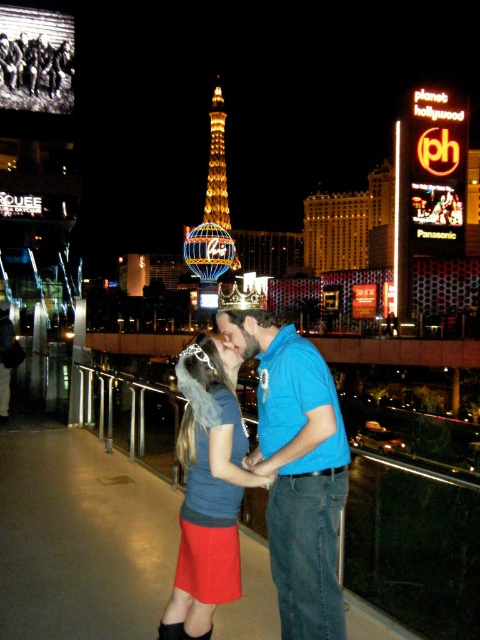
Question: Does matte red skirt at center have a larger size compared to blue illuminated tower at center?

Choices:
 (A) yes
 (B) no

Answer: (B)

Question: Which point is closer to the camera?

Choices:
 (A) (181, 572)
 (B) (334, 528)
 (C) (173, 592)

Answer: (C)

Question: Which point is closer to the camera taking this photo?

Choices:
 (A) (239, 417)
 (B) (322, 584)
 (C) (218, 492)

Answer: (B)

Question: Can you confirm if matte red skirt at center is thinner than blue illuminated tower at center?

Choices:
 (A) yes
 (B) no

Answer: (A)

Question: Which is nearer to the blue illuminated tower at center?

Choices:
 (A) matte red skirt at center
 (B) denim skirt at center
 (C) blue cotton shirt at center

Answer: (C)

Question: Is the position of blue cotton shirt at center less distant than that of blue illuminated tower at center?

Choices:
 (A) yes
 (B) no

Answer: (A)